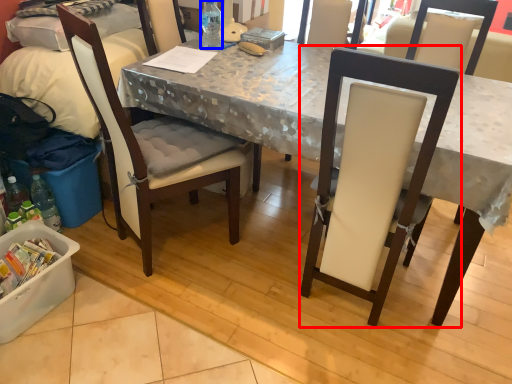
Question: Which of the following is the closest to the observer, chair (highlighted by a red box) or bottle (highlighted by a blue box)?

Choices:
 (A) chair
 (B) bottle

Answer: (A)